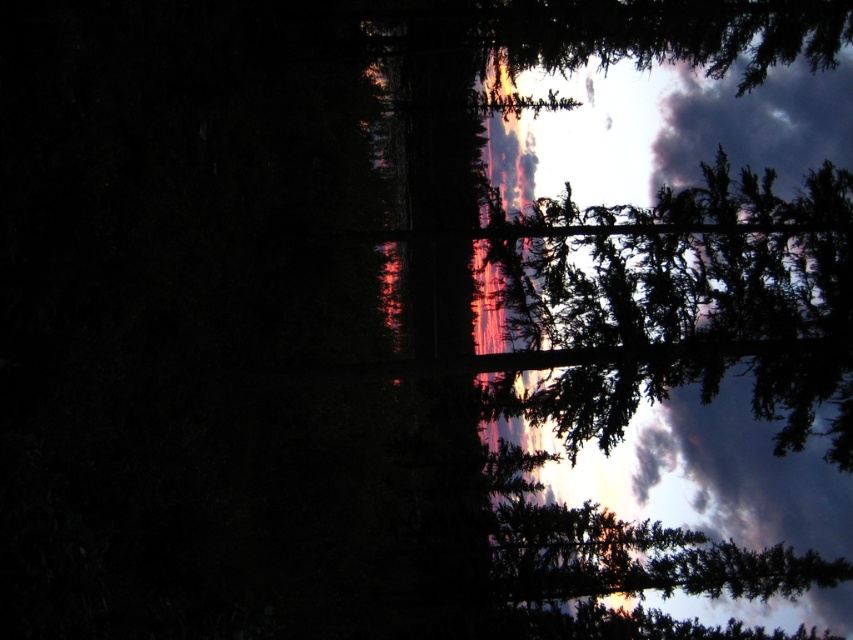
Can you confirm if green textured tree at upper right is positioned to the right of green matte tree at upper center?

Indeed, green textured tree at upper right is positioned on the right side of green matte tree at upper center.

Which is behind, point (764, 292) or point (561, 44)?

Positioned behind is point (561, 44).

This screenshot has width=853, height=640. I want to click on green textured tree at upper right, so click(x=686, y=304).